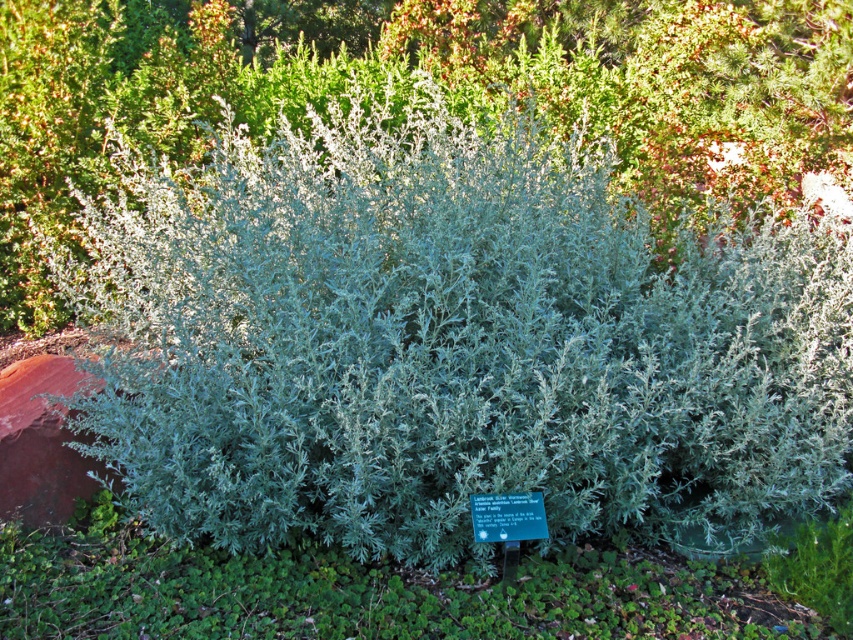
Question: Does silvery-green foliage at center have a larger size compared to green plastic sign at center?

Choices:
 (A) no
 (B) yes

Answer: (B)

Question: Which of the following is the closest to the observer?

Choices:
 (A) [x=538, y=509]
 (B) [x=485, y=16]

Answer: (A)

Question: Can you confirm if silvery-green foliage at center is positioned below green plastic sign at center?

Choices:
 (A) yes
 (B) no

Answer: (B)

Question: Can you confirm if silvery-green foliage at center is smaller than green plastic sign at center?

Choices:
 (A) yes
 (B) no

Answer: (B)